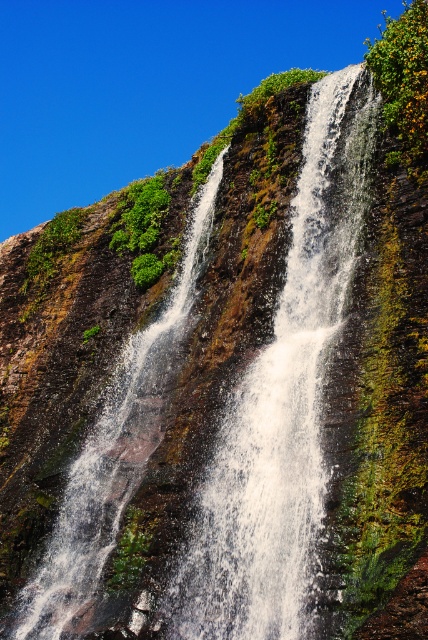
Question: Where is white frothy water at center located in relation to white frothy water at left in the image?

Choices:
 (A) above
 (B) below

Answer: (A)

Question: Which of the following is the farthest from the observer?

Choices:
 (A) (74, 470)
 (B) (207, 552)

Answer: (A)

Question: Is the position of white frothy water at center more distant than that of white frothy water at left?

Choices:
 (A) yes
 (B) no

Answer: (B)

Question: Does white frothy water at center have a greater width compared to white frothy water at left?

Choices:
 (A) no
 (B) yes

Answer: (B)

Question: Which of the following is the closest to the observer?

Choices:
 (A) white frothy water at center
 (B) white frothy water at left

Answer: (A)